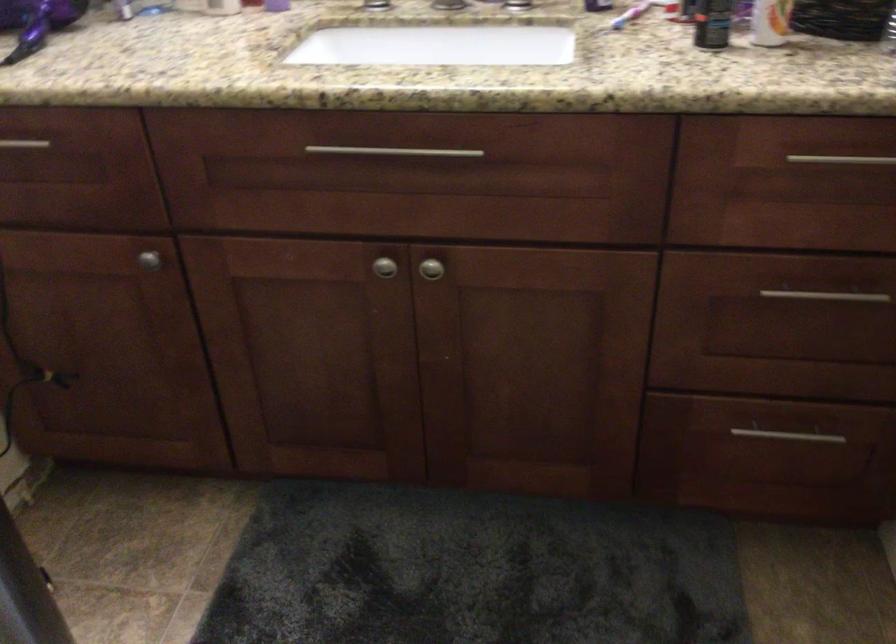
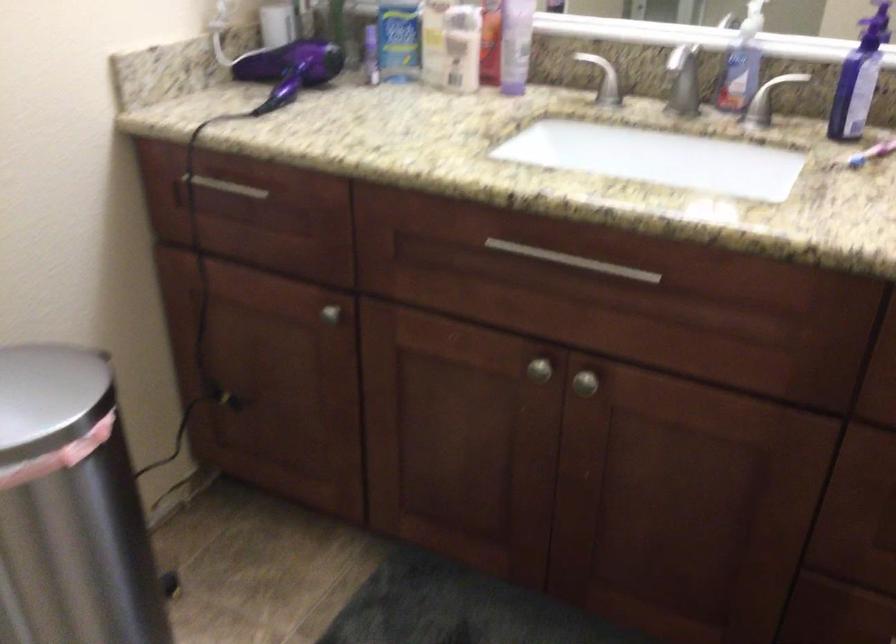
Which direction would the cameraman need to move to produce the second image?

The cameraman moved toward right, forward.